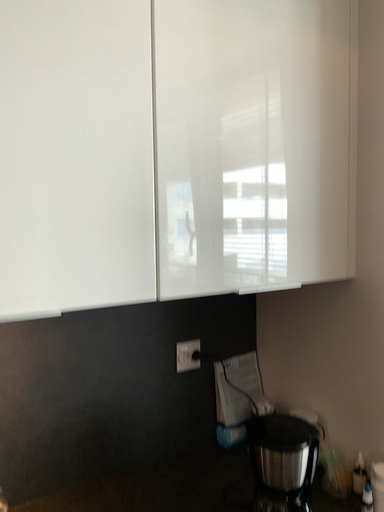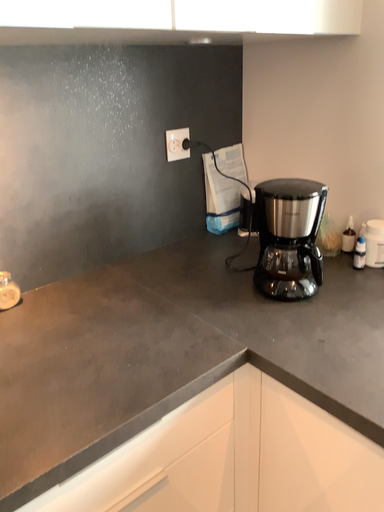
Question: How did the camera likely rotate when shooting the video?

Choices:
 (A) rotated upward
 (B) rotated downward

Answer: (B)